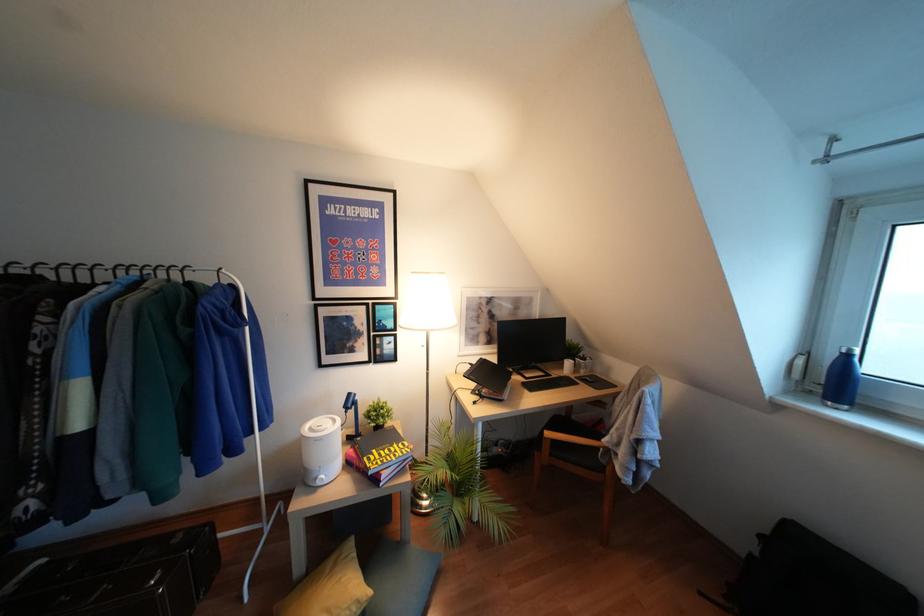
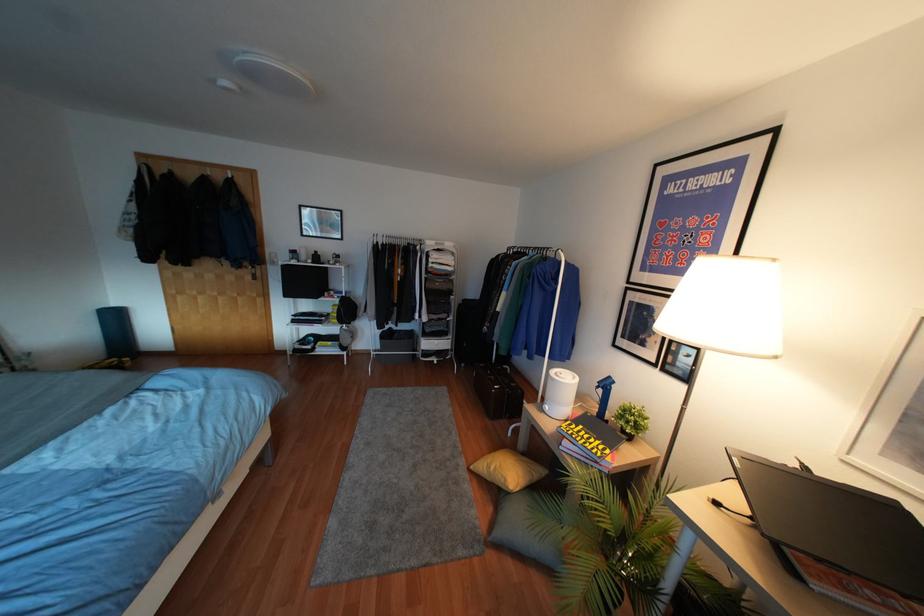
Question: The camera is either moving clockwise (left) or counter-clockwise (right) around the object. The first image is from the beginning of the video and the second image is from the end. Is the camera moving left or right when shooting the video?

Choices:
 (A) Left
 (B) Right

Answer: (B)